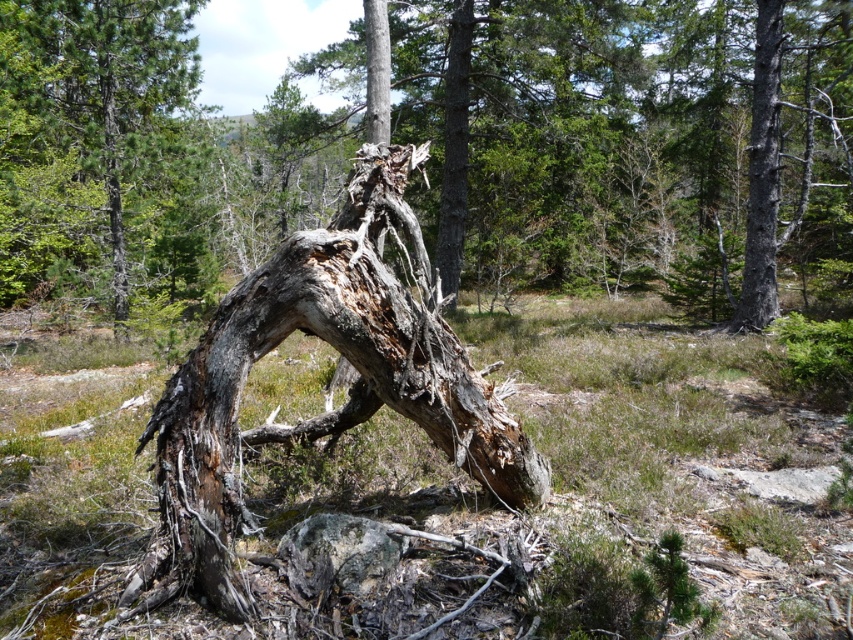
Question: Which point is closer to the camera?

Choices:
 (A) [x=753, y=60]
 (B) [x=177, y=128]
 (C) [x=247, y=291]

Answer: (C)

Question: Does gray bark tree at center have a smaller size compared to smooth gray bark at upper right?

Choices:
 (A) yes
 (B) no

Answer: (A)

Question: Among these objects, which one is nearest to the camera?

Choices:
 (A) gray bark tree at center
 (B) smooth gray bark at upper right

Answer: (B)

Question: Does grayish-brown bark at center appear under smooth gray bark at upper right?

Choices:
 (A) no
 (B) yes

Answer: (B)

Question: Among these objects, which one is farthest from the camera?

Choices:
 (A) gray bark tree at center
 (B) grayish-brown bark at center
 (C) smooth gray bark at upper right

Answer: (A)

Question: Is grayish-brown bark at center further to the viewer compared to gray bark tree at center?

Choices:
 (A) no
 (B) yes

Answer: (A)